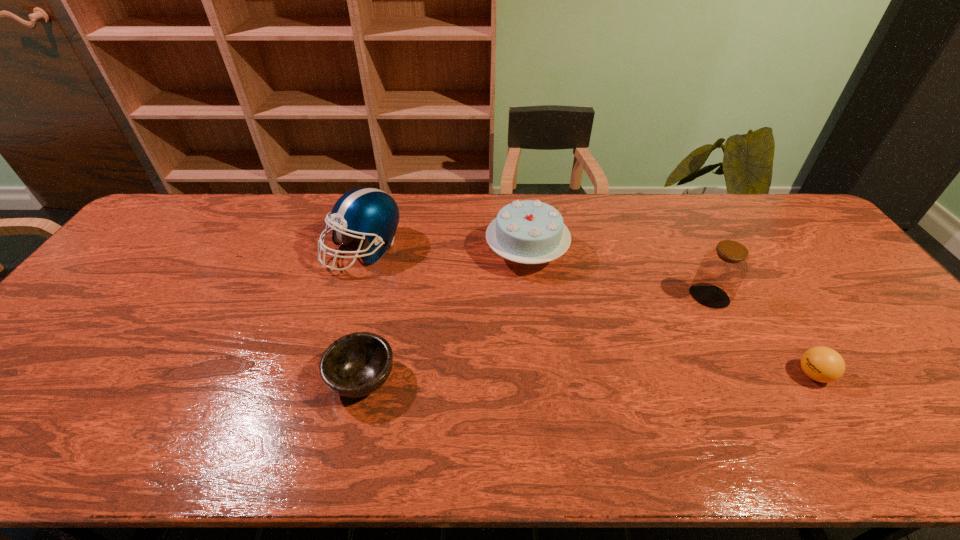
Find the location of a particular element. This screenshot has width=960, height=540. vacant space that's between the football helmet and the ping-pong ball is located at coordinates (588, 312).

This screenshot has height=540, width=960. I want to click on free spot between the ping-pong ball and the football helmet, so click(588, 312).

What are the coordinates of `vacant area between the rightmost object and the jar` in the screenshot? It's located at (761, 335).

Find the location of a particular element. The height and width of the screenshot is (540, 960). empty space that is in between the football helmet and the jar is located at coordinates (537, 273).

This screenshot has width=960, height=540. What are the coordinates of `free space between the football helmet and the third farthest object` in the screenshot? It's located at (537, 273).

Where is `free point between the birthday cake and the jar`? This screenshot has width=960, height=540. free point between the birthday cake and the jar is located at coordinates point(618,274).

Where is `free spot between the third farthest object and the ping-pong ball`? This screenshot has height=540, width=960. free spot between the third farthest object and the ping-pong ball is located at coordinates (761, 335).

The height and width of the screenshot is (540, 960). I want to click on empty space that is in between the rightmost object and the bowl, so click(588, 376).

In order to click on vacant point located between the birthday cake and the bowl in this screenshot , I will do `click(444, 315)`.

The height and width of the screenshot is (540, 960). In order to click on vacant area that lies between the football helmet and the birthday cake in this screenshot , I will do `click(445, 251)`.